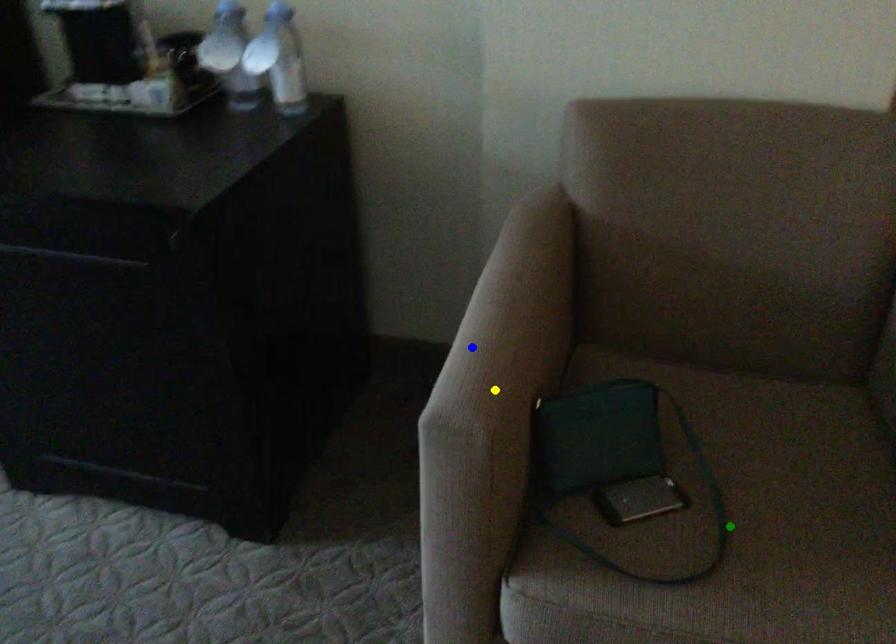
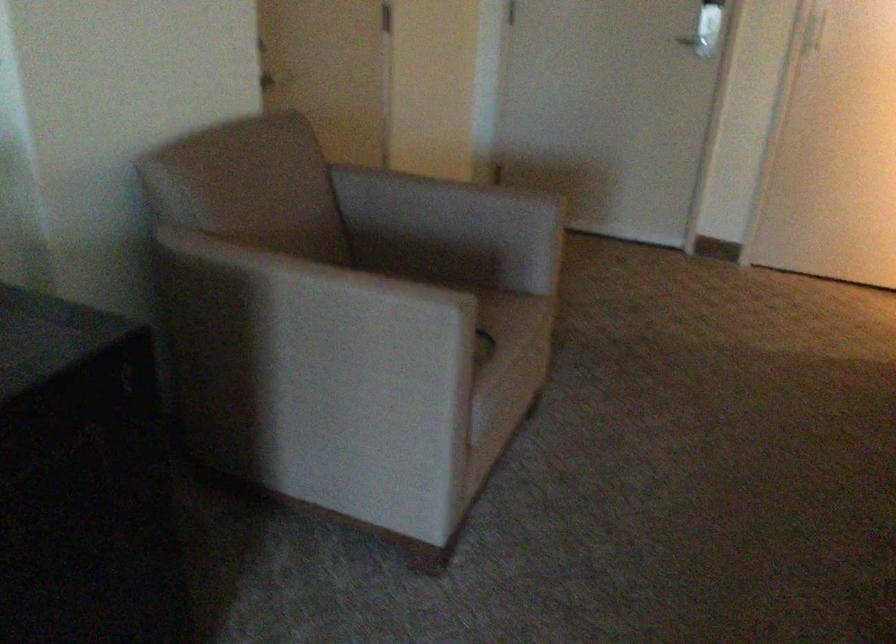
I am providing you with two images of the same scene from different viewpoints. Three points are marked in image1. Which point corresponds to a part or object that is occluded in image2?In image1, three points are marked. Which of them correspond to a part or object that is occluded in image2?Among the three points shown in image1, which one corresponds to a part or object that is no longer visible due to occlusion in image2?

Invisible in image2: green point.